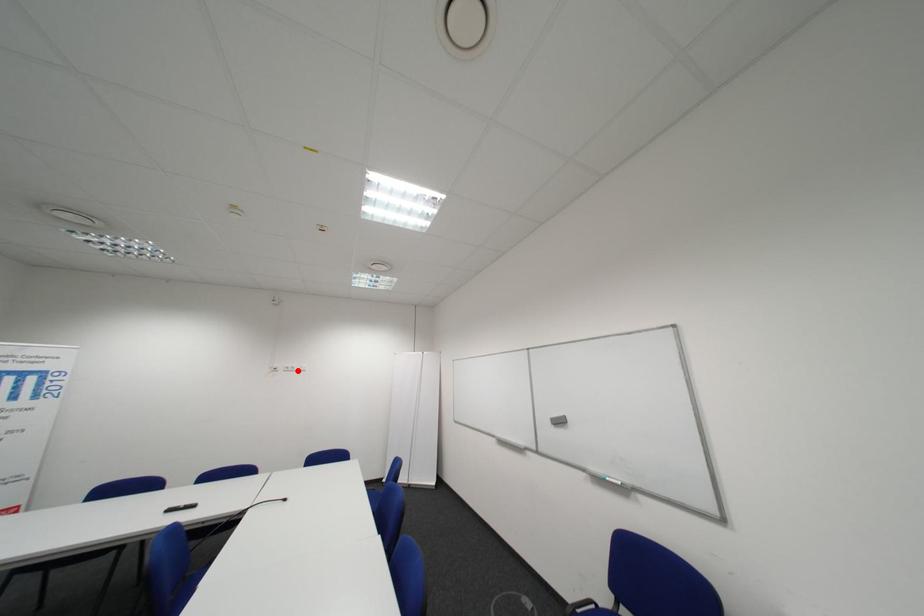
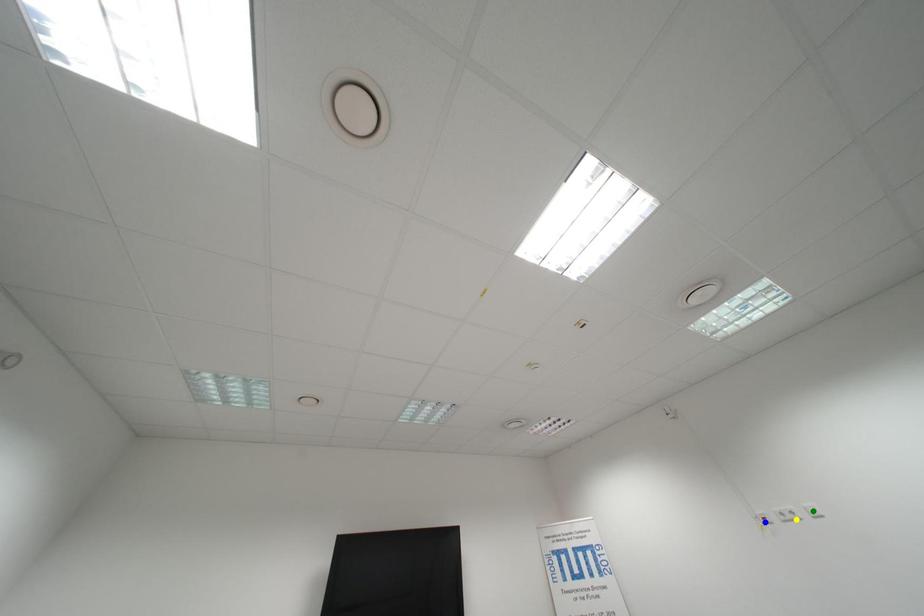
Question: I am providing you with two images of the same scene from different viewpoints. A red point is marked on the first image. You are given multiple points on the second image. Can you choose the point in image 2 that corresponds to the point in image 1?

Choices:
 (A) blue point
 (B) green point
 (C) yellow point

Answer: (C)